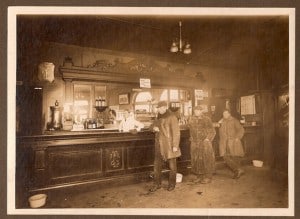
Image resolution: width=300 pixels, height=219 pixels. I want to click on window, so click(x=145, y=100), click(x=164, y=95).